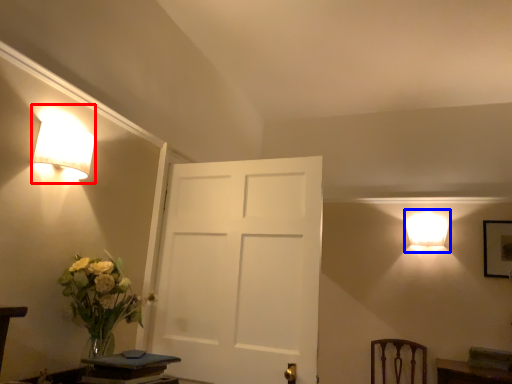
Question: Which point is further to the camera, lamp (highlighted by a red box) or lamp (highlighted by a blue box)?

Choices:
 (A) lamp
 (B) lamp

Answer: (B)